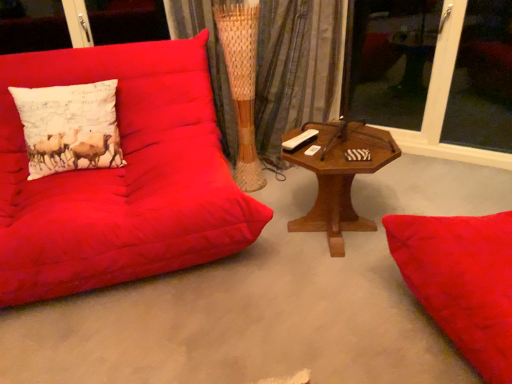
This screenshot has height=384, width=512. What are the coordinates of `spots to the right of woodenobject at center` in the screenshot? It's located at (414, 195).